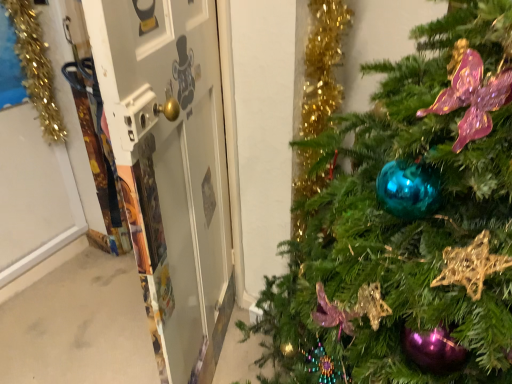
Question: Visually, is shiny teal ornament at center-right positioned to the left or to the right of metallic gold screen door at left?

Choices:
 (A) right
 (B) left

Answer: (A)

Question: Is shiny teal ornament at center-right in front of or behind metallic gold screen door at left in the image?

Choices:
 (A) behind
 (B) front

Answer: (B)

Question: Considering the real-world distances, which object is farthest from the shiny teal ornament at center-right?

Choices:
 (A) metallic gold screen door at left
 (B) gold tinsel garland at left

Answer: (B)

Question: Which object is the farthest from the gold tinsel garland at left?

Choices:
 (A) shiny teal ornament at center-right
 (B) metallic gold screen door at left

Answer: (A)